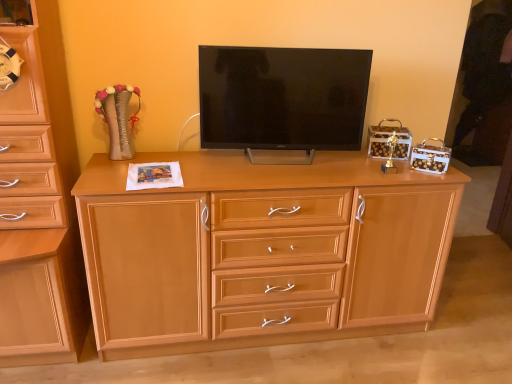
This screenshot has width=512, height=384. I want to click on matte black tv at center, so click(282, 101).

Image resolution: width=512 pixels, height=384 pixels. Describe the element at coordinates (261, 251) in the screenshot. I see `light wood chest of drawers at center, which appears as the 1th chest of drawers when viewed from the right` at that location.

Locate an element on the screen. light wood chest of drawers at center, which is the second chest of drawers from left to right is located at coordinates (261, 251).

I want to click on matte black tv at center, so click(x=282, y=101).

Does matte black tv at center touch light wood chest of drawers at center, which is the second chest of drawers from left to right?

No, matte black tv at center is not next to light wood chest of drawers at center, which is the second chest of drawers from left to right.

Between matte black tv at center and light wood chest of drawers at center, which is the second chest of drawers from left to right, which one has smaller size?

With smaller size is matte black tv at center.

From a real-world perspective, between matte black tv at center and light wood chest of drawers at center, which appears as the 1th chest of drawers when viewed from the right, who is vertically higher?

matte black tv at center, from a real-world perspective.

Which object is further away from the camera taking this photo, matte black tv at center or light wood chest of drawers at center, which is the second chest of drawers from left to right?

matte black tv at center is further from the camera.

Can you tell me how much light wood chest of drawers at center, which appears as the 1th chest of drawers when viewed from the right, and matte wood chest of drawers at left, the second chest of drawers viewed from the right, differ in facing direction?

The angular difference between light wood chest of drawers at center, which appears as the 1th chest of drawers when viewed from the right, and matte wood chest of drawers at left, the second chest of drawers viewed from the right, is 1.05 degrees.

Looking at their sizes, would you say light wood chest of drawers at center, which appears as the 1th chest of drawers when viewed from the right, is wider or thinner than matte wood chest of drawers at left, the second chest of drawers viewed from the right?

In the image, light wood chest of drawers at center, which appears as the 1th chest of drawers when viewed from the right, appears to be more narrow than matte wood chest of drawers at left, the second chest of drawers viewed from the right.

From a real-world perspective, is light wood chest of drawers at center, which is the second chest of drawers from left to right, positioned above or below matte wood chest of drawers at left, the second chest of drawers viewed from the right?

light wood chest of drawers at center, which is the second chest of drawers from left to right, is below matte wood chest of drawers at left, the second chest of drawers viewed from the right.

Is light wood chest of drawers at center, which is the second chest of drawers from left to right, oriented towards matte wood chest of drawers at left, the second chest of drawers viewed from the right?

No, light wood chest of drawers at center, which is the second chest of drawers from left to right, is not facing towards matte wood chest of drawers at left, the second chest of drawers viewed from the right.

Is matte wood chest of drawers at left, the second chest of drawers viewed from the right, far away from light wood chest of drawers at center, which appears as the 1th chest of drawers when viewed from the right?

No, matte wood chest of drawers at left, the second chest of drawers viewed from the right, is not far away from light wood chest of drawers at center, which appears as the 1th chest of drawers when viewed from the right.

From a real-world perspective, is matte wood chest of drawers at left, the second chest of drawers viewed from the right, located higher than light wood chest of drawers at center, which is the second chest of drawers from left to right?

Yes, from a real-world perspective, matte wood chest of drawers at left, the second chest of drawers viewed from the right, is above light wood chest of drawers at center, which is the second chest of drawers from left to right.

Looking at this image, which of these two, matte wood chest of drawers at left, the second chest of drawers viewed from the right, or light wood chest of drawers at center, which is the second chest of drawers from left to right, is bigger?

light wood chest of drawers at center, which is the second chest of drawers from left to right.

Which is farther, (45, 270) or (277, 239)?

The point (277, 239) is behind.

Is matte black tv at center at the back of matte wood chest of drawers at left, the second chest of drawers viewed from the right?

matte wood chest of drawers at left, the second chest of drawers viewed from the right, does not have its back to matte black tv at center.

Based on the photo, between matte wood chest of drawers at left, the 1th chest of drawers viewed from the left, and matte black tv at center, which one is positioned behind?

matte black tv at center is further from the camera.

From the image's perspective, which is above, matte wood chest of drawers at left, the 1th chest of drawers viewed from the left, or matte black tv at center?

matte black tv at center is shown above in the image.

Can you confirm if matte black tv at center is thinner than matte wood chest of drawers at left, the second chest of drawers viewed from the right?

Indeed, matte black tv at center has a lesser width compared to matte wood chest of drawers at left, the second chest of drawers viewed from the right.

Is matte black tv at center next to matte wood chest of drawers at left, the 1th chest of drawers viewed from the left?

No, matte black tv at center is not next to matte wood chest of drawers at left, the 1th chest of drawers viewed from the left.

Between matte black tv at center and matte wood chest of drawers at left, the 1th chest of drawers viewed from the left, which one has larger size?

With larger size is matte wood chest of drawers at left, the 1th chest of drawers viewed from the left.

From a real-world perspective, relative to matte black tv at center, is light wood chest of drawers at center, which is the second chest of drawers from left to right, vertically above or below?

light wood chest of drawers at center, which is the second chest of drawers from left to right, is below matte black tv at center.

Considering the relative positions of light wood chest of drawers at center, which appears as the 1th chest of drawers when viewed from the right, and matte black tv at center in the image provided, is light wood chest of drawers at center, which appears as the 1th chest of drawers when viewed from the right, to the right of matte black tv at center from the viewer's perspective?

Incorrect, light wood chest of drawers at center, which appears as the 1th chest of drawers when viewed from the right, is not on the right side of matte black tv at center.

Is light wood chest of drawers at center, which appears as the 1th chest of drawers when viewed from the right, facing towards matte black tv at center?

No, light wood chest of drawers at center, which appears as the 1th chest of drawers when viewed from the right, is not aimed at matte black tv at center.

You are a GUI agent. You are given a task and a screenshot of the screen. Output one action in this format:
    pyautogui.click(x=<x>, y=<y>)
    Task: Click on the television that is above the light wood chest of drawers at center, which appears as the 1th chest of drawers when viewed from the right (from the image's perspective)
    The height and width of the screenshot is (384, 512).
    Given the screenshot: What is the action you would take?
    pyautogui.click(x=282, y=101)

The image size is (512, 384). Find the location of `chest of drawers lying on the left of light wood chest of drawers at center, which appears as the 1th chest of drawers when viewed from the right`. chest of drawers lying on the left of light wood chest of drawers at center, which appears as the 1th chest of drawers when viewed from the right is located at coordinates (40, 203).

Consider the image. Estimate the real-world distances between objects in this image. Which object is closer to matte wood chest of drawers at left, the 1th chest of drawers viewed from the left, matte black tv at center or light wood chest of drawers at center, which is the second chest of drawers from left to right?

Based on the image, light wood chest of drawers at center, which is the second chest of drawers from left to right, appears to be nearer to matte wood chest of drawers at left, the 1th chest of drawers viewed from the left.

Considering their positions, is matte wood chest of drawers at left, the second chest of drawers viewed from the right, positioned closer to matte black tv at center than light wood chest of drawers at center, which is the second chest of drawers from left to right?

The object closer to matte black tv at center is light wood chest of drawers at center, which is the second chest of drawers from left to right.

Based on their spatial positions, is matte black tv at center or matte wood chest of drawers at left, the 1th chest of drawers viewed from the left, closer to light wood chest of drawers at center, which appears as the 1th chest of drawers when viewed from the right?

matte black tv at center is positioned closer to the anchor light wood chest of drawers at center, which appears as the 1th chest of drawers when viewed from the right.

Based on their spatial positions, is light wood chest of drawers at center, which appears as the 1th chest of drawers when viewed from the right, or matte wood chest of drawers at left, the second chest of drawers viewed from the right, further from matte black tv at center?

Based on the image, matte wood chest of drawers at left, the second chest of drawers viewed from the right, appears to be further to matte black tv at center.

Considering their positions, is light wood chest of drawers at center, which appears as the 1th chest of drawers when viewed from the right, positioned closer to matte wood chest of drawers at left, the second chest of drawers viewed from the right, than matte black tv at center?

Among the two, light wood chest of drawers at center, which appears as the 1th chest of drawers when viewed from the right, is located nearer to matte wood chest of drawers at left, the second chest of drawers viewed from the right.

When comparing their distances from light wood chest of drawers at center, which is the second chest of drawers from left to right, does matte wood chest of drawers at left, the second chest of drawers viewed from the right, or matte black tv at center seem further?

Based on the image, matte wood chest of drawers at left, the second chest of drawers viewed from the right, appears to be further to light wood chest of drawers at center, which is the second chest of drawers from left to right.

This screenshot has width=512, height=384. In order to click on chest of drawers between matte wood chest of drawers at left, the second chest of drawers viewed from the right, and matte black tv at center in this screenshot , I will do click(261, 251).